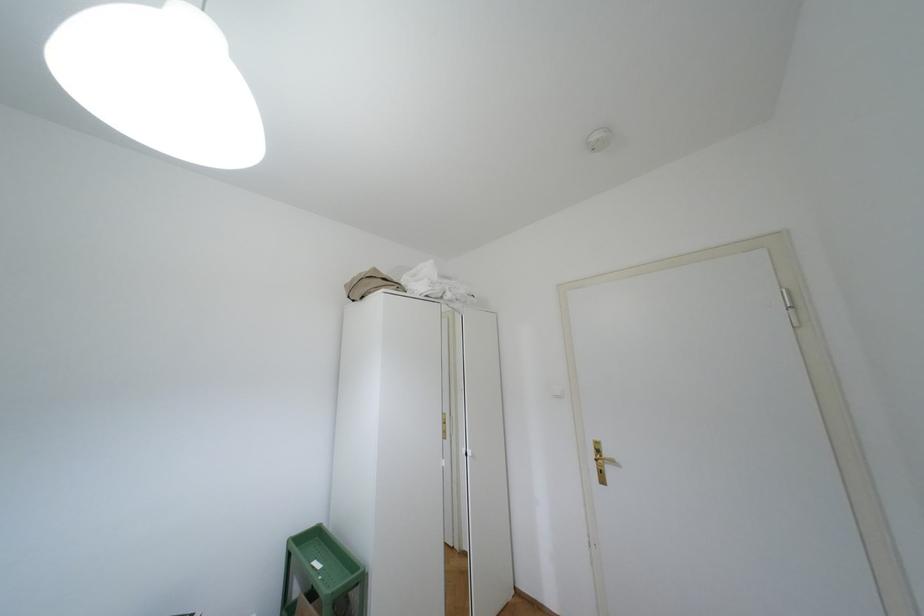
I want to click on white light switch, so click(x=556, y=391).